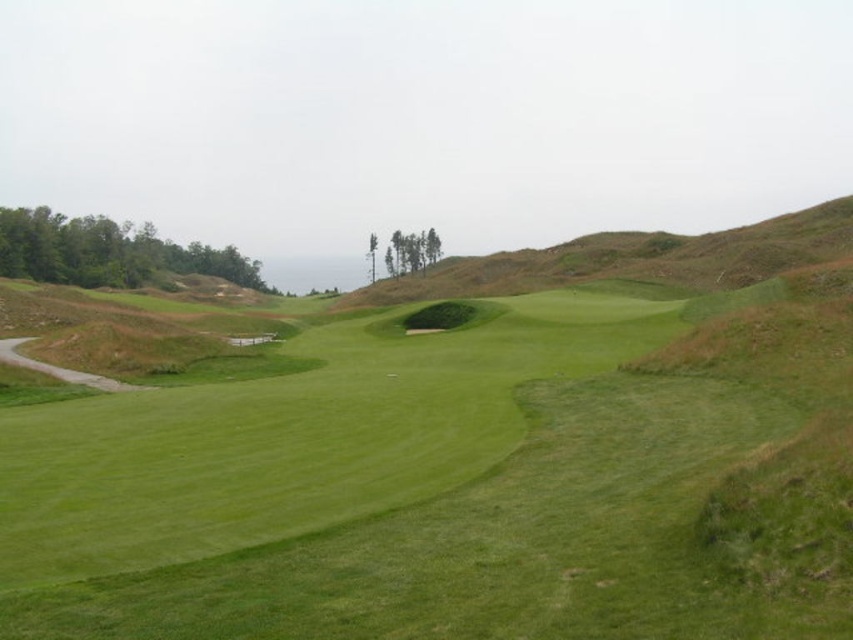
Question: Which point is closer to the camera taking this photo?

Choices:
 (A) (165, 589)
 (B) (474, 264)

Answer: (A)

Question: Observing the image, what is the correct spatial positioning of green grassy golf course at center in reference to brown earthy hillside at center?

Choices:
 (A) right
 (B) left

Answer: (B)

Question: Which of the following is the closest to the observer?

Choices:
 (A) brown earthy hillside at center
 (B) green grassy golf course at center

Answer: (B)

Question: Is green grassy golf course at center closer to the viewer compared to brown earthy hillside at center?

Choices:
 (A) yes
 (B) no

Answer: (A)

Question: Does green grassy golf course at center come behind brown earthy hillside at center?

Choices:
 (A) no
 (B) yes

Answer: (A)